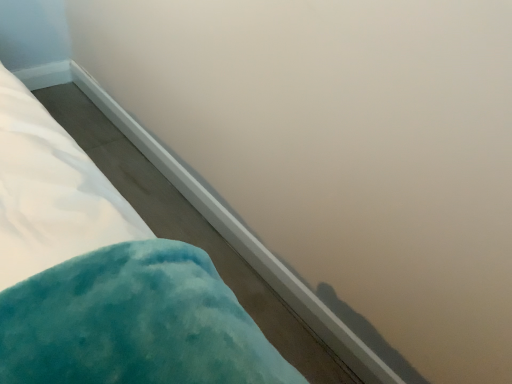
What do you see at coordinates (104, 276) in the screenshot? I see `teal plush bed at lower left` at bounding box center [104, 276].

You are a GUI agent. You are given a task and a screenshot of the screen. Output one action in this format:
    pyautogui.click(x=<x>, y=<y>)
    Task: Click on the teal plush bed at lower left
    The height and width of the screenshot is (384, 512).
    Given the screenshot: What is the action you would take?
    pyautogui.click(x=104, y=276)

At what (x,y) coordinates should I click in order to perform the action: click on teal plush bed at lower left. Please return your answer as a coordinate pair (x, y). Looking at the image, I should click on (104, 276).